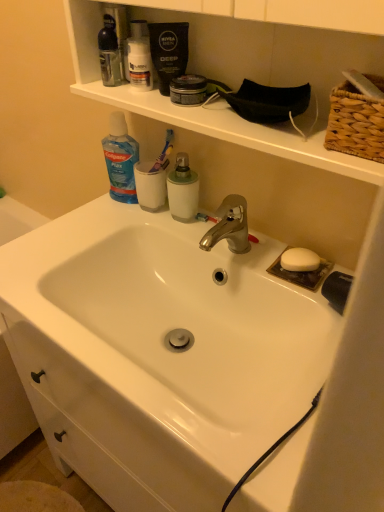
Where is `vacant region to the left of white matte mouthwash at center, which appears as the first mouthwash when ordered from the bottom`? vacant region to the left of white matte mouthwash at center, which appears as the first mouthwash when ordered from the bottom is located at coordinates (105, 225).